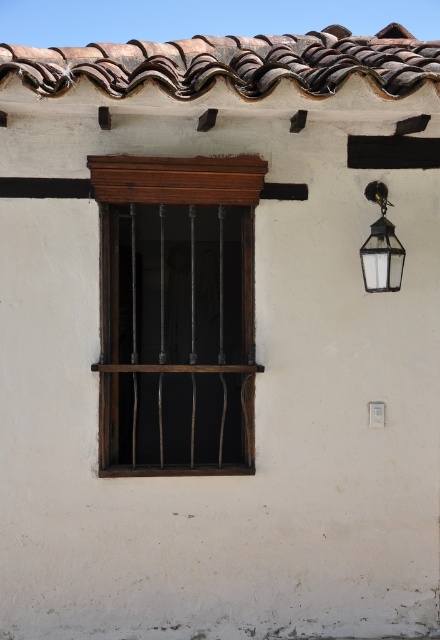
You are standing in front of the traditional Spanish colonial building. You notice the dark wood window frame at center and the matte glass lantern at upper right. Which object is located higher up in the image?

The matte glass lantern at upper right is located higher up than the dark wood window frame at center.

You are an architect designing a restoration project for this building. You need to install a new light fixture that matches the existing style. The brown textured tiles at upper center and the matte glass lantern at upper right are key elements. Which object should you place closer to the left side of the building to maintain symmetry?

The brown textured tiles at upper center should be placed closer to the left side because they are positioned on the left side of the matte glass lantern at upper right, maintaining symmetry by aligning with the existing design elements.